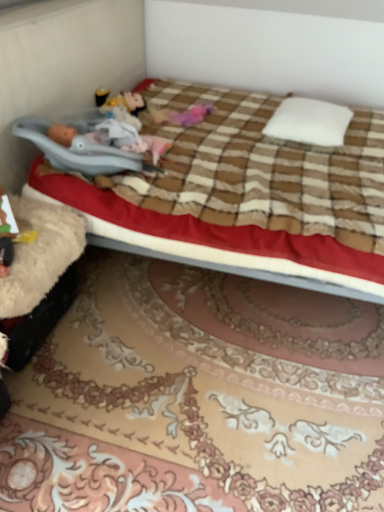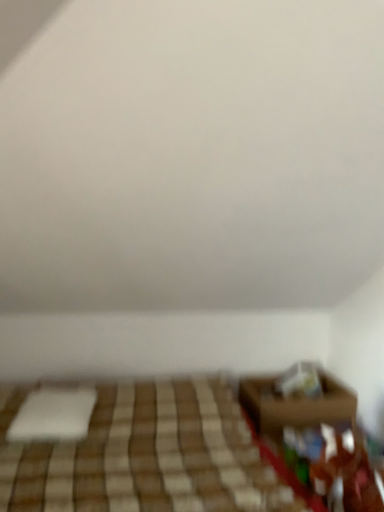
Question: Which way did the camera rotate in the video?

Choices:
 (A) rotated right
 (B) rotated left

Answer: (A)